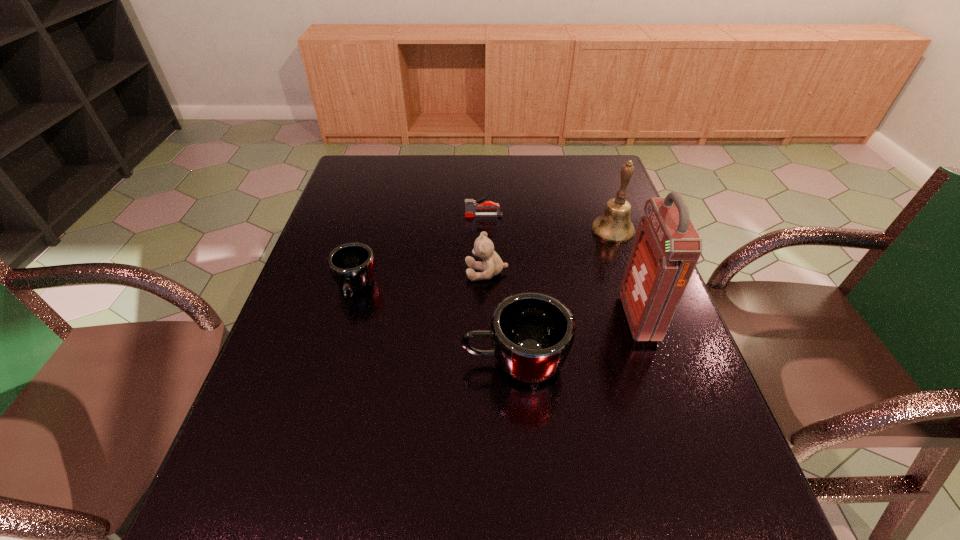
Observe the arrangement of all mugs in the image. To keep them evenly spaced, where would you place another mug on the right? Please locate a free space. Please provide its 2D coordinates. Your answer should be formatted as a tuple, i.e. [(x, y)], where the tuple contains the x and y coordinates of a point satisfying the conditions above.

[(739, 465)]